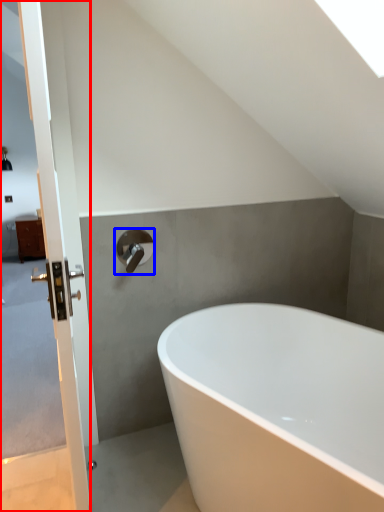
Question: Which of the following is the farthest to the observer, screen door (highlighted by a red box) or tap (highlighted by a blue box)?

Choices:
 (A) screen door
 (B) tap

Answer: (B)